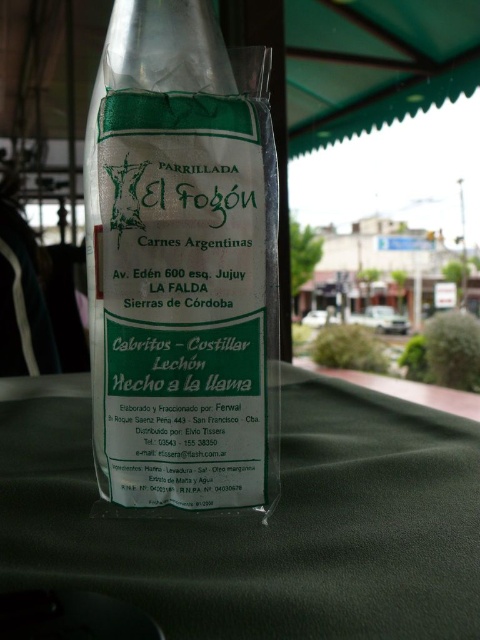
Consider the image. What is the relationship between the transparent plastic bag at center and the green fabric table at center in terms of their positions?

The green fabric table at center is behind the transparent plastic bag at center, meaning the bag is positioned in front of the table.

What is the spatial relationship between the transparent plastic bag at center and the green fabric table at center in the scene?

The transparent plastic bag at center is located to the left of the green fabric table at center.

You are a delivery person who needs to confirm the position of the transparent plastic bag at center on the packaging. According to the coordinates provided, where exactly is it placed?

The transparent plastic bag at center is located at point coordinates (180,268).